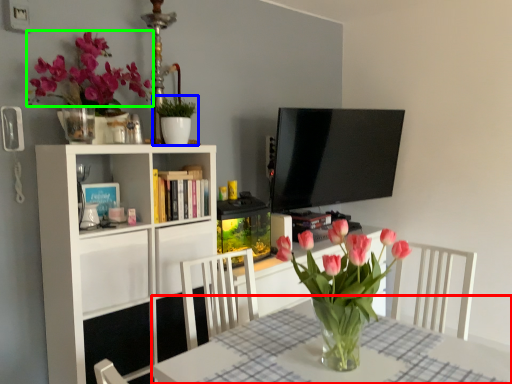
Question: Which object is the closest to the table (highlighted by a red box)? Choose among these: houseplant (highlighted by a blue box) or flower (highlighted by a green box).

Choices:
 (A) houseplant
 (B) flower

Answer: (A)